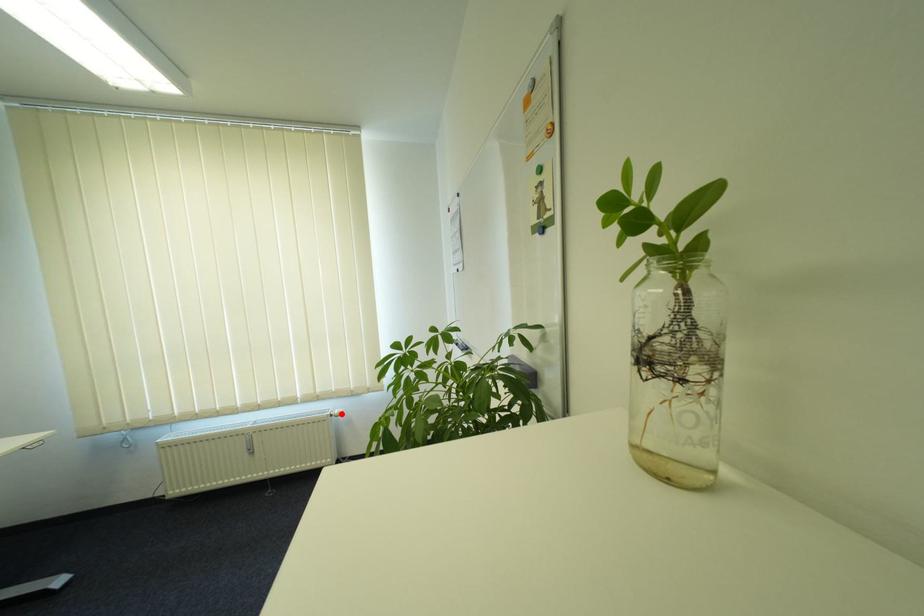
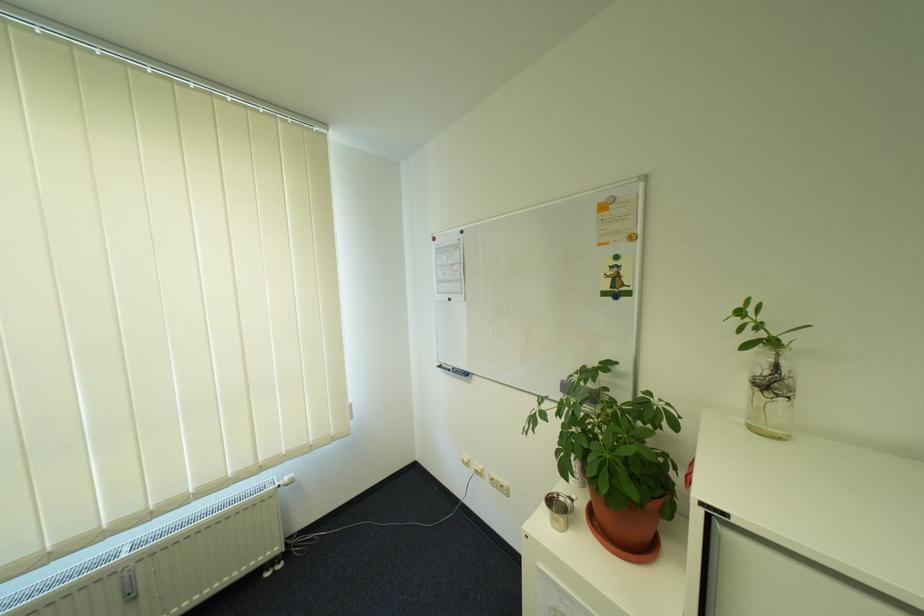
Locate, in the second image, the point that corresponds to the highlighted location in the first image.

(290, 484)